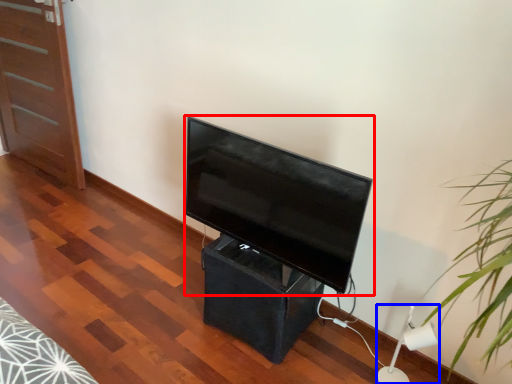
Question: Among these objects, which one is farthest to the camera, television (highlighted by a red box) or lamp (highlighted by a blue box)?

Choices:
 (A) television
 (B) lamp

Answer: (B)